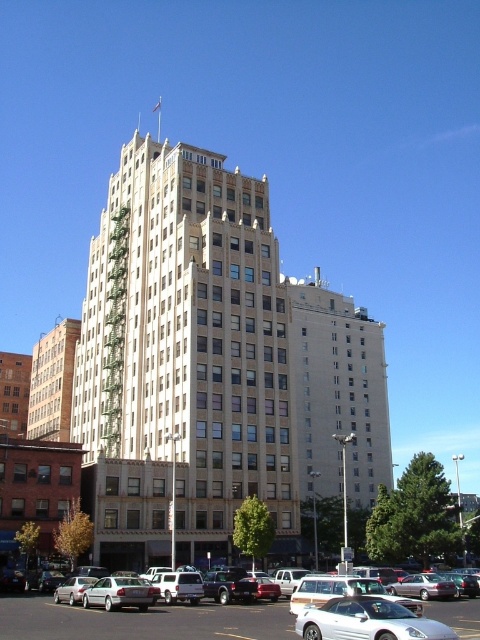
You are a delivery driver who needs to park your truck between the silver metallic sedan at lower center and the silver metallic car at center. Can you fit your truck, which is 2 meters wide, between them?

The silver metallic sedan at lower center is larger than the silver metallic car at center, but the exact distance between them is not provided. Without knowing the space between the two vehicles, it is impossible to determine if your truck can fit.

You are a pedestrian standing in front of the white smooth building at center and the silver metallic car at center. Which object is closer to your left side?

The white smooth building at center is closer to your left side because it is positioned to the left of the silver metallic car at center.

Based on the photo, you are a pedestrian standing on the sidewalk in front of the white smooth building at center. You want to cross the street to reach the silver metallic car at center. Is the car visible from your current position?

The silver metallic car at center is behind the white smooth building at center, so it is not visible from the pedestrian standing in front of the building.